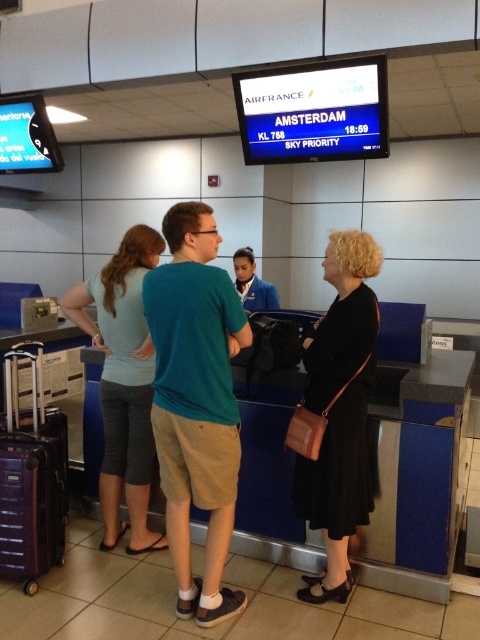
Is black matte dress at center wider than maroon textured suitcase at lower left?

No.

What do you see at coordinates (339, 410) in the screenshot? I see `black matte dress at center` at bounding box center [339, 410].

Does point (360, 234) come in front of point (24, 516)?

Yes, it is.

Where is `black matte dress at center`? This screenshot has height=640, width=480. black matte dress at center is located at coordinates (339, 410).

Based on the photo, is the position of teal fabric shirt at center less distant than that of black matte dress at center?

Yes, it is.

Between teal fabric shirt at center and black matte dress at center, which one has less height?

Standing shorter between the two is black matte dress at center.

Between point (240, 314) and point (344, 592), which one is positioned in front?

Point (240, 314) is more forward.

This screenshot has width=480, height=640. I want to click on teal fabric shirt at center, so click(x=195, y=403).

Does teal fabric shirt at center appear under light blue fabric pants at left?

Yes.

Which is above, teal fabric shirt at center or light blue fabric pants at left?

Positioned higher is light blue fabric pants at left.

Between point (194, 397) and point (104, 512), which one is positioned behind?

The point (104, 512) is behind.

Image resolution: width=480 pixels, height=640 pixels. What are the coordinates of `teal fabric shirt at center` in the screenshot? It's located at (195, 403).